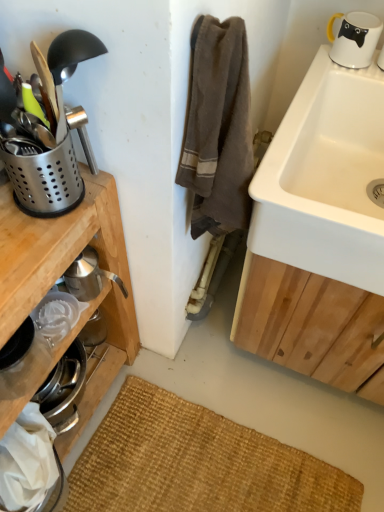
Question: Is polished stainless steel utensil holder at left, which is the 2th appliance from back to front, in front of or behind polished stainless steel utensil holder at left, which is counted as the 1th appliance, starting from the back, in the image?

Choices:
 (A) front
 (B) behind

Answer: (A)

Question: Considering the positions of polished stainless steel utensil holder at left, positioned as the 1th appliance in front-to-back order, and polished stainless steel utensil holder at left, the second appliance positioned from the front, in the image, is polished stainless steel utensil holder at left, positioned as the 1th appliance in front-to-back order, bigger or smaller than polished stainless steel utensil holder at left, the second appliance positioned from the front,?

Choices:
 (A) small
 (B) big

Answer: (B)

Question: Which object is positioned closest to the polished stainless steel utensil holder at left, which is counted as the 1th appliance, starting from the back?

Choices:
 (A) white ceramic sink at upper right
 (B) polished stainless steel utensil holder at left, positioned as the 1th appliance in front-to-back order
 (C) white glossy mug at upper right

Answer: (B)

Question: Estimate the real-world distances between objects in this image. Which object is farther from the polished stainless steel utensil holder at left, which is the 2th appliance from back to front?

Choices:
 (A) polished stainless steel utensil holder at left, which is counted as the 1th appliance, starting from the back
 (B) white glossy mug at upper right
 (C) white ceramic sink at upper right

Answer: (B)